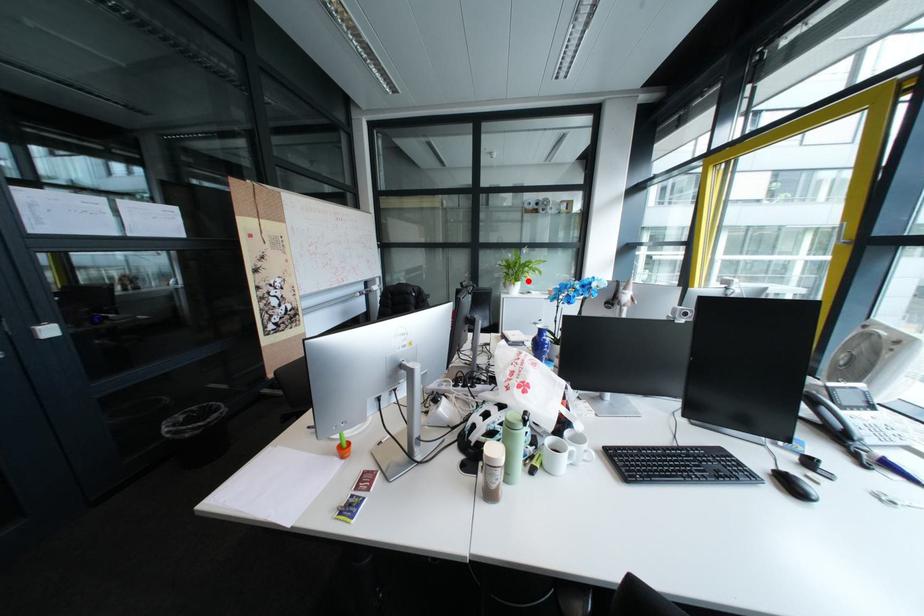
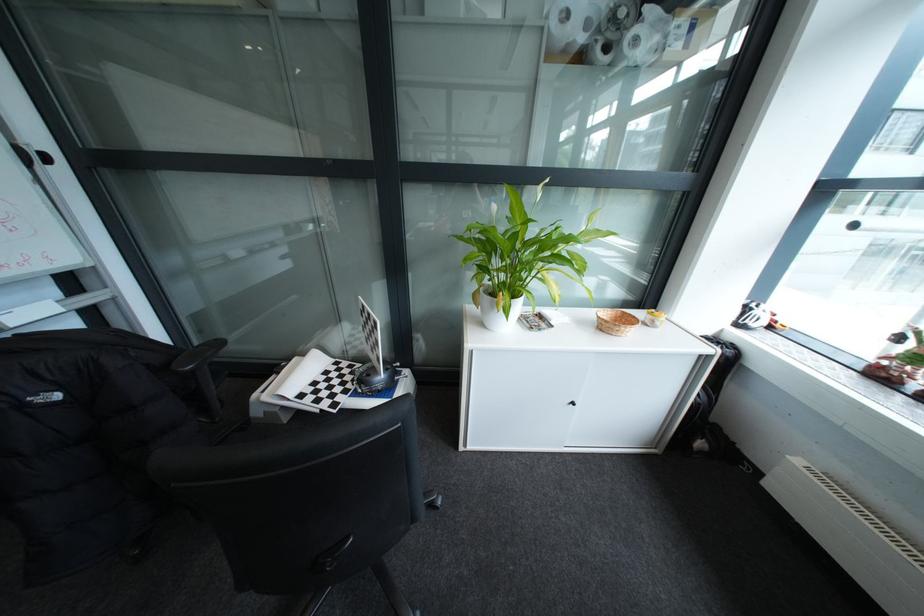
In the second image, find the point that corresponds to the highlighted location in the first image.

(521, 299)